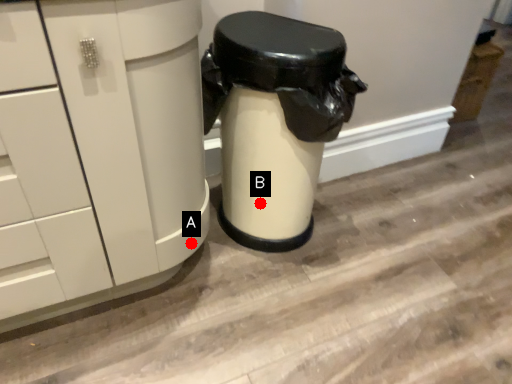
Question: Two points are circled on the image, labeled by A and B beside each circle. Which point is further to the camera?

Choices:
 (A) A is further
 (B) B is further

Answer: (B)